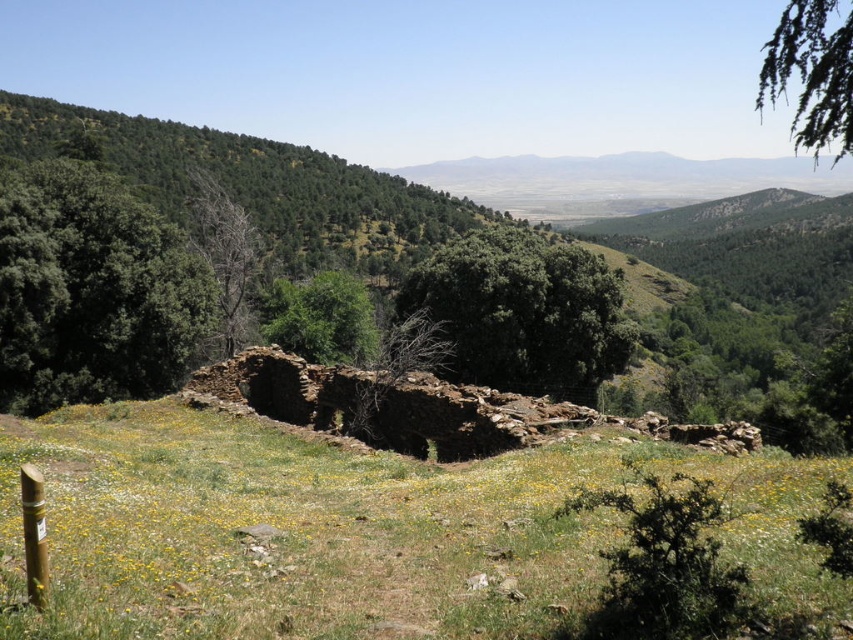
Question: Which point is farther from the camera taking this photo?

Choices:
 (A) (222, 348)
 (B) (550, 326)

Answer: (A)

Question: Is green textured branch at upper right positioned before green leafy tree at center?

Choices:
 (A) yes
 (B) no

Answer: (A)

Question: Which of the following is the farthest from the observer?

Choices:
 (A) bare wood tree at center-left
 (B) green grassy at center
 (C) green textured branch at upper right

Answer: (A)

Question: Which object is closer to the camera taking this photo?

Choices:
 (A) green grassy at center
 (B) green rough bark tree at center

Answer: (A)

Question: Is green leafy tree at left bigger than green leafy tree at center?

Choices:
 (A) yes
 (B) no

Answer: (A)

Question: Is green grassy at center to the left of bare wood tree at center-left from the viewer's perspective?

Choices:
 (A) no
 (B) yes

Answer: (A)